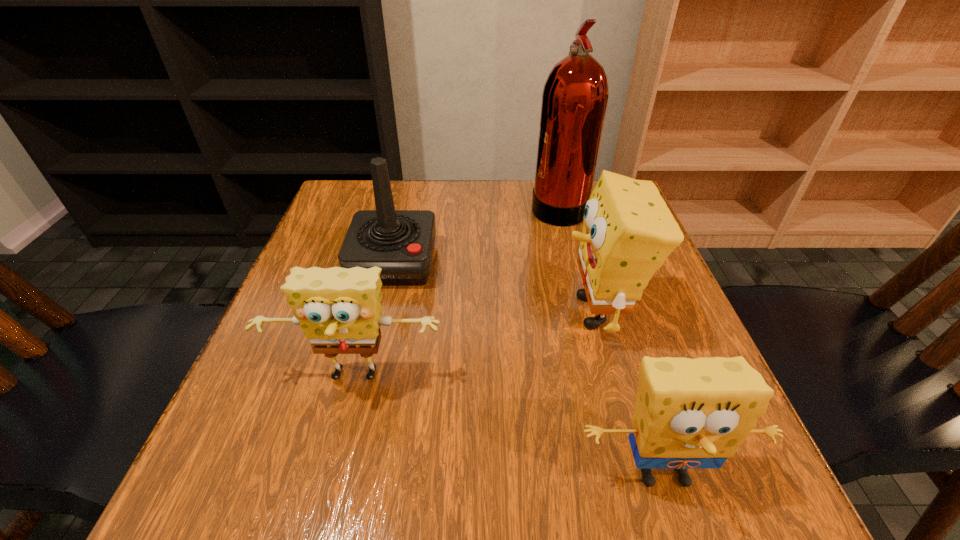
Image resolution: width=960 pixels, height=540 pixels. In order to click on vacant region between the joystick and the farthest sponge in this screenshot , I will do `click(495, 287)`.

The image size is (960, 540). Find the location of `vacant space that is in between the fire extinguisher and the joystick`. vacant space that is in between the fire extinguisher and the joystick is located at coordinates (476, 233).

Identify the location of empty space between the joystick and the nearest object. The width and height of the screenshot is (960, 540). (528, 368).

What are the coordinates of `empty space between the tallest sponge and the joystick` in the screenshot? It's located at (495, 287).

The width and height of the screenshot is (960, 540). Identify the location of vacant space in between the tallest sponge and the leftmost sponge. (476, 345).

You are a GUI agent. You are given a task and a screenshot of the screen. Output one action in this format:
    pyautogui.click(x=<x>, y=<y>)
    Task: Click on the empty space between the joystick and the nearest object
    The width and height of the screenshot is (960, 540).
    Given the screenshot: What is the action you would take?
    pyautogui.click(x=528, y=368)

Identify the location of free space between the farthest object and the nearest sponge. This screenshot has height=540, width=960. (611, 339).

Where is `unoccupied area between the joystick and the farthest sponge`? Image resolution: width=960 pixels, height=540 pixels. unoccupied area between the joystick and the farthest sponge is located at coordinates (495, 287).

You are a GUI agent. You are given a task and a screenshot of the screen. Output one action in this format:
    pyautogui.click(x=<x>, y=<y>)
    Task: Click on the third closest object to the farthest sponge
    Image resolution: width=960 pixels, height=540 pixels.
    Given the screenshot: What is the action you would take?
    pyautogui.click(x=339, y=309)

Find the location of a particular element. Image resolution: width=960 pixels, height=540 pixels. the third closest object to the nearest object is located at coordinates (401, 242).